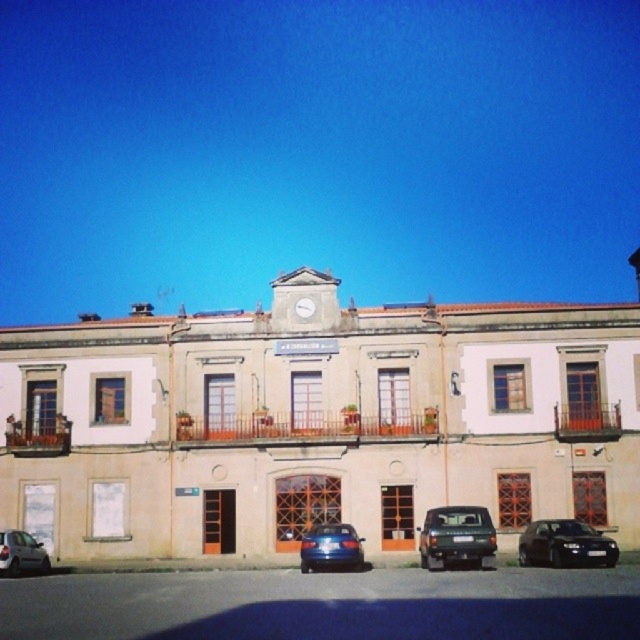
Question: Does green matte car at lower center have a lesser width compared to black matte car at lower right?

Choices:
 (A) no
 (B) yes

Answer: (B)

Question: Can you confirm if black matte car at lower right is bigger than shiny blue sedan at center?

Choices:
 (A) no
 (B) yes

Answer: (B)

Question: Which of these objects is positioned farthest from the shiny blue sedan at center?

Choices:
 (A) black matte car at lower right
 (B) metallic silver car at lower left

Answer: (B)

Question: Estimate the real-world distances between objects in this image. Which object is farther from the black matte car at lower right?

Choices:
 (A) shiny blue sedan at center
 (B) metallic silver car at lower left
 (C) white plastic clock at center
 (D) green matte car at lower center

Answer: (B)

Question: Estimate the real-world distances between objects in this image. Which object is closer to the metallic silver car at lower left?

Choices:
 (A) shiny blue sedan at center
 (B) black matte car at lower right
 (C) green matte car at lower center
 (D) white plastic clock at center

Answer: (A)

Question: Can you confirm if metallic silver car at lower left is positioned to the right of white plastic clock at center?

Choices:
 (A) yes
 (B) no

Answer: (B)